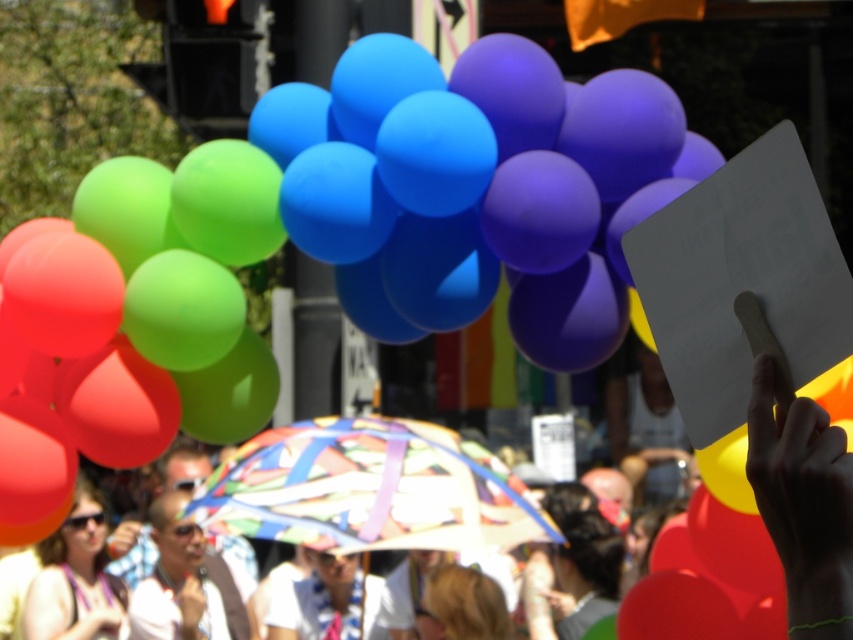
Locate an element on the screen. The height and width of the screenshot is (640, 853). rubber balloons at upper center is located at coordinates (320, 246).

Which is below, rubber balloons at upper center or white shirt at center?

white shirt at center is below.

Describe the element at coordinates (320, 246) in the screenshot. The width and height of the screenshot is (853, 640). I see `rubber balloons at upper center` at that location.

This screenshot has width=853, height=640. Find the location of `rubber balloons at upper center`. rubber balloons at upper center is located at coordinates (320, 246).

Can you confirm if white shirt at center is smaller than matte plastic umbrella at center?

Yes, white shirt at center is smaller than matte plastic umbrella at center.

Is white shirt at center above matte plastic umbrella at center?

No.

This screenshot has width=853, height=640. Describe the element at coordinates (183, 582) in the screenshot. I see `white shirt at center` at that location.

The width and height of the screenshot is (853, 640). I want to click on white shirt at center, so click(183, 582).

Which of these two, white shirt at center or matte black sunglasses at lower left, stands shorter?

Standing shorter between the two is matte black sunglasses at lower left.

Can you confirm if white shirt at center is positioned to the left of matte black sunglasses at lower left?

No, white shirt at center is not to the left of matte black sunglasses at lower left.

The width and height of the screenshot is (853, 640). What do you see at coordinates (183, 582) in the screenshot?
I see `white shirt at center` at bounding box center [183, 582].

Image resolution: width=853 pixels, height=640 pixels. I want to click on white shirt at center, so (183, 582).